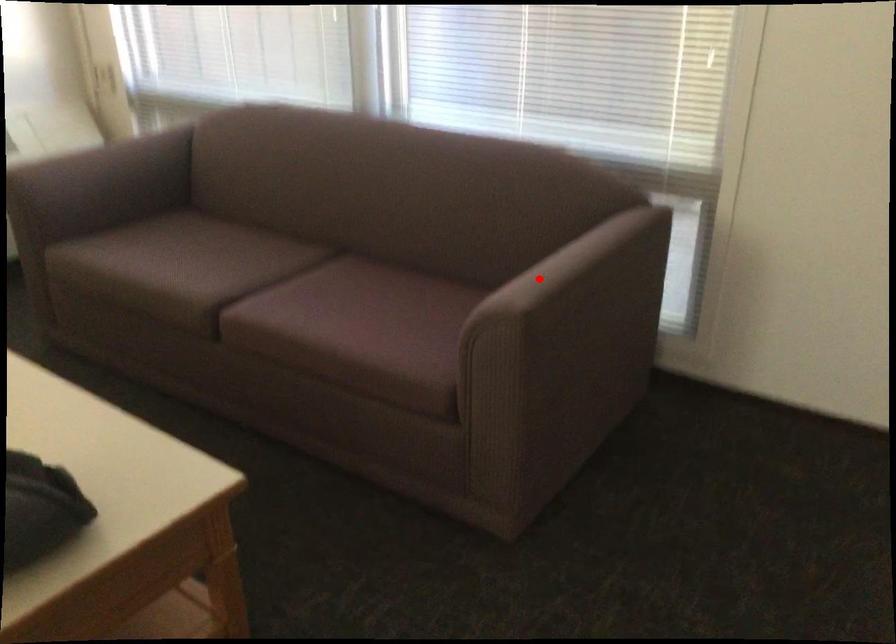
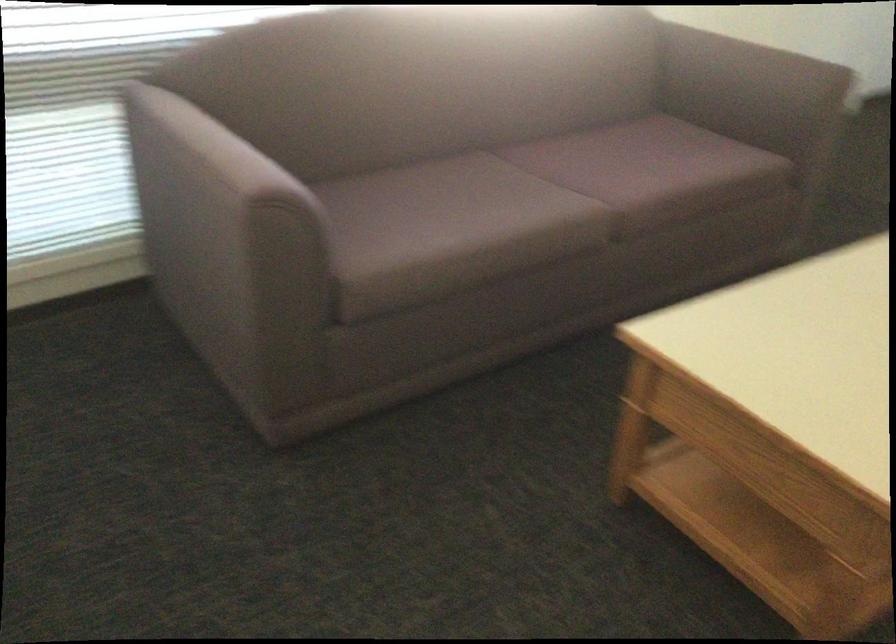
In the second image, find the point that corresponds to the highlighted location in the first image.

(746, 73)